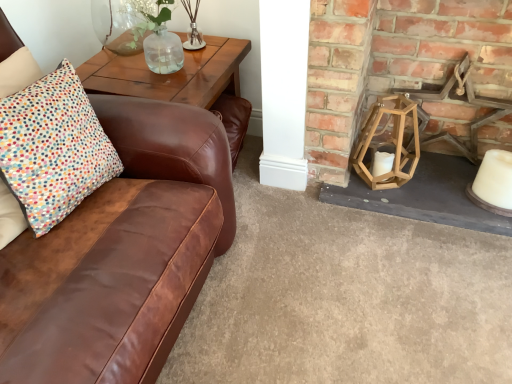
Question: Is wooden hexagonal lantern at right, which is counted as the 1th candle holder, starting from the bottom, not near white matte candle at lower right?

Choices:
 (A) no
 (B) yes

Answer: (A)

Question: Is wooden hexagonal lantern at right, which ranks as the second candle holder in top-to-bottom order, to the right of white matte candle at lower right from the viewer's perspective?

Choices:
 (A) yes
 (B) no

Answer: (B)

Question: Could you tell me if wooden hexagonal lantern at right, which is counted as the 1th candle holder, starting from the bottom, is turned towards white matte candle at lower right?

Choices:
 (A) yes
 (B) no

Answer: (B)

Question: Is white matte candle at lower right located within wooden hexagonal lantern at right, the first candle holder from the right?

Choices:
 (A) no
 (B) yes

Answer: (A)

Question: From a real-world perspective, is wooden hexagonal lantern at right, which is the 2th candle holder in left-to-right order, physically below white matte candle at lower right?

Choices:
 (A) no
 (B) yes

Answer: (A)

Question: From a real-world perspective, is multicolored dotted cushion at left above or below wooden lantern at right?

Choices:
 (A) below
 (B) above

Answer: (B)

Question: Considering the relative positions of multicolored dotted cushion at left and wooden lantern at right in the image provided, is multicolored dotted cushion at left to the left or to the right of wooden lantern at right?

Choices:
 (A) right
 (B) left

Answer: (B)

Question: Based on their sizes in the image, would you say multicolored dotted cushion at left is bigger or smaller than wooden lantern at right?

Choices:
 (A) big
 (B) small

Answer: (B)

Question: From their relative heights in the image, would you say multicolored dotted cushion at left is taller or shorter than wooden lantern at right?

Choices:
 (A) tall
 (B) short

Answer: (B)

Question: Considering the positions of wooden hexagonal lantern at right, which is counted as the 1th candle holder, starting from the bottom, and clear glass vase at upper center, acting as the 2th candle holder starting from the right, in the image, is wooden hexagonal lantern at right, which is counted as the 1th candle holder, starting from the bottom, taller or shorter than clear glass vase at upper center, acting as the 2th candle holder starting from the right,?

Choices:
 (A) short
 (B) tall

Answer: (B)

Question: Is wooden hexagonal lantern at right, which is the 2th candle holder in left-to-right order, in front of or behind clear glass vase at upper center, marked as the 1th candle holder in a top-to-bottom arrangement, in the image?

Choices:
 (A) front
 (B) behind

Answer: (A)

Question: Does point (375, 185) appear closer or farther from the camera than point (195, 36)?

Choices:
 (A) farther
 (B) closer

Answer: (A)

Question: Considering the positions of wooden hexagonal lantern at right, which is the 2th candle holder in left-to-right order, and clear glass vase at upper center, marked as the 1th candle holder in a top-to-bottom arrangement, in the image, is wooden hexagonal lantern at right, which is the 2th candle holder in left-to-right order, wider or thinner than clear glass vase at upper center, marked as the 1th candle holder in a top-to-bottom arrangement,?

Choices:
 (A) thin
 (B) wide

Answer: (B)

Question: Is clear glass vase at upper center, acting as the 2th candle holder starting from the right, in front of or behind wooden lantern at right in the image?

Choices:
 (A) front
 (B) behind

Answer: (B)

Question: From the image's perspective, is clear glass vase at upper center, the first candle holder viewed from the left, located above or below wooden lantern at right?

Choices:
 (A) below
 (B) above

Answer: (B)